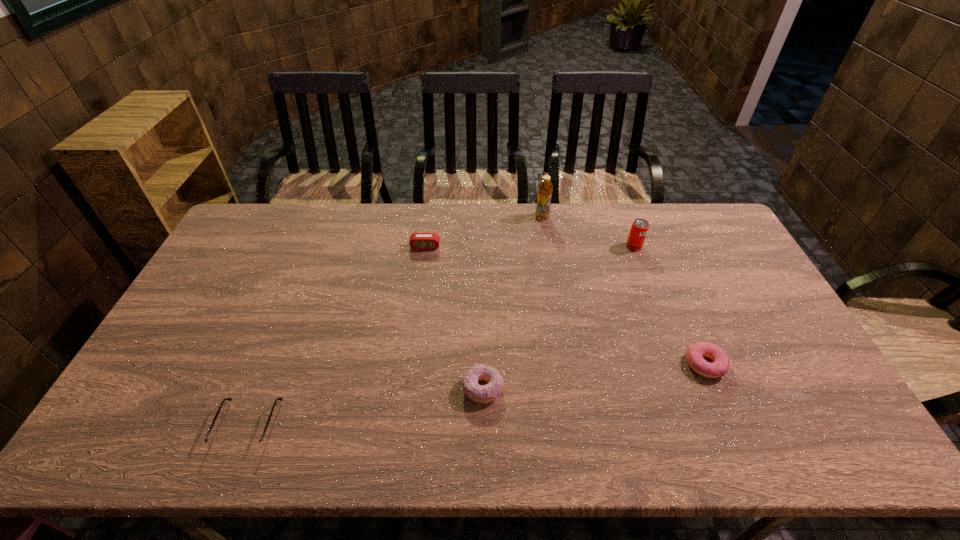
Find the location of a particular element. the third object from right to left is located at coordinates (545, 187).

The image size is (960, 540). In order to click on the farthest object in this screenshot , I will do `click(545, 187)`.

The image size is (960, 540). What are the coordinates of `can` in the screenshot? It's located at (639, 228).

Where is `the taller doughnut`? the taller doughnut is located at coordinates (486, 393).

At what (x,y) coordinates should I click in order to perform the action: click on the fourth object from right to left. Please return your answer as a coordinate pair (x, y). This screenshot has height=540, width=960. Looking at the image, I should click on (486, 393).

The height and width of the screenshot is (540, 960). Identify the location of the fifth object from right to left. [418, 241].

Find the location of `spectacles`. spectacles is located at coordinates (215, 444).

This screenshot has width=960, height=540. I want to click on the right doughnut, so click(721, 363).

Identify the location of vacant space located on the right of the farthest object. This screenshot has width=960, height=540. (573, 217).

You are a GUI agent. You are given a task and a screenshot of the screen. Output one action in this format:
    pyautogui.click(x=<x>, y=<y>)
    Task: Click on the vacant area situated 0.070m on the back of the fifth shortest object
    The height and width of the screenshot is (540, 960).
    Given the screenshot: What is the action you would take?
    pyautogui.click(x=628, y=228)